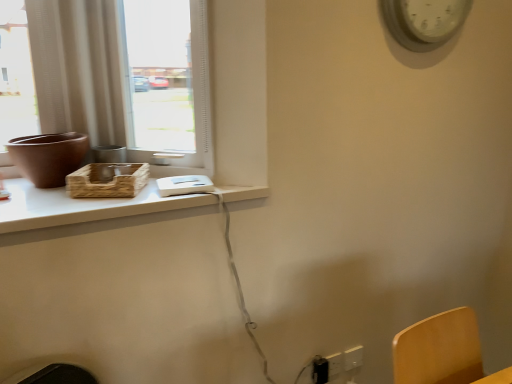
Question: Is matte glass window at upper left smaller than white plastic tray at upper left?

Choices:
 (A) yes
 (B) no

Answer: (B)

Question: Is matte glass window at upper left to the left of white plastic tray at upper left from the viewer's perspective?

Choices:
 (A) no
 (B) yes

Answer: (A)

Question: Is matte glass window at upper left at the right side of white plastic tray at upper left?

Choices:
 (A) yes
 (B) no

Answer: (A)

Question: Is matte glass window at upper left outside of white plastic tray at upper left?

Choices:
 (A) yes
 (B) no

Answer: (A)

Question: Is matte glass window at upper left positioned behind white plastic tray at upper left?

Choices:
 (A) no
 (B) yes

Answer: (B)

Question: From the image's perspective, is black plastic electric outlet at lower right, arranged as the first electric outlet when viewed from the left, located above or below matte brown vase at left?

Choices:
 (A) above
 (B) below

Answer: (B)

Question: Do you think black plastic electric outlet at lower right, arranged as the third electric outlet when viewed from the right, is within matte brown vase at left, or outside of it?

Choices:
 (A) inside
 (B) outside

Answer: (B)

Question: Is black plastic electric outlet at lower right, arranged as the third electric outlet when viewed from the right, bigger or smaller than matte brown vase at left?

Choices:
 (A) small
 (B) big

Answer: (A)

Question: Is black plastic electric outlet at lower right, arranged as the third electric outlet when viewed from the right, in front of or behind matte brown vase at left in the image?

Choices:
 (A) front
 (B) behind

Answer: (B)

Question: From their relative heights in the image, would you say black plastic electric outlet at lower right, arranged as the third electric outlet when viewed from the right, is taller or shorter than white plastic clock at upper right?

Choices:
 (A) short
 (B) tall

Answer: (A)

Question: From a real-world perspective, relative to white plastic clock at upper right, is black plastic electric outlet at lower right, arranged as the first electric outlet when viewed from the left, vertically above or below?

Choices:
 (A) above
 (B) below

Answer: (B)

Question: Is black plastic electric outlet at lower right, arranged as the third electric outlet when viewed from the right, wider or thinner than white plastic clock at upper right?

Choices:
 (A) thin
 (B) wide

Answer: (A)

Question: Based on their sizes in the image, would you say black plastic electric outlet at lower right, arranged as the first electric outlet when viewed from the left, is bigger or smaller than white plastic clock at upper right?

Choices:
 (A) big
 (B) small

Answer: (B)

Question: Is white plastic tray at upper left wider or thinner than white plastic electric outlet at lower right, arranged as the third electric outlet when viewed from the left?

Choices:
 (A) wide
 (B) thin

Answer: (A)

Question: From the image's perspective, is white plastic tray at upper left above or below white plastic electric outlet at lower right, which ranks as the first electric outlet in right-to-left order?

Choices:
 (A) below
 (B) above

Answer: (B)